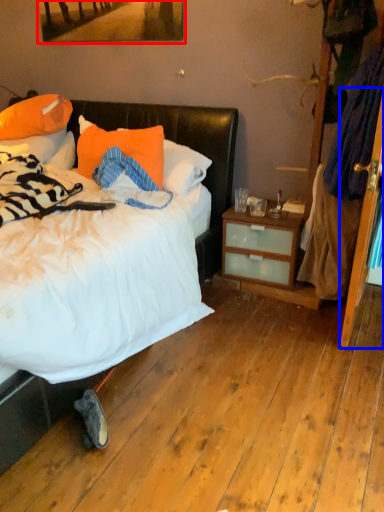
Question: Which point is closer to the camera, picture frame (highlighted by a red box) or screen door (highlighted by a blue box)?

Choices:
 (A) picture frame
 (B) screen door

Answer: (B)